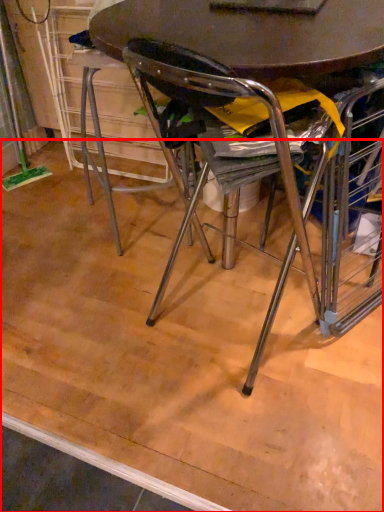
Question: From the image's perspective, what is the correct spatial positioning of plywood (annotated by the red box) in reference to table?

Choices:
 (A) below
 (B) above

Answer: (A)